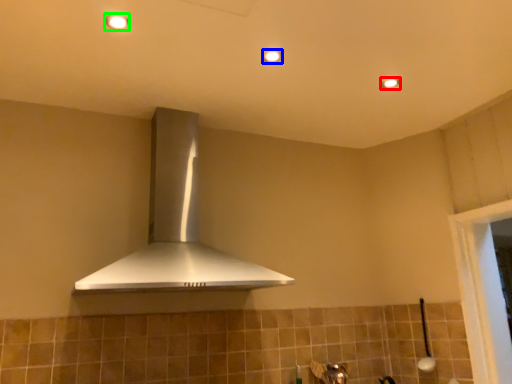
Question: Which is nearer to the light fixture (highlighted by a red box)? light fixture (highlighted by a blue box) or light fixture (highlighted by a green box).

Choices:
 (A) light fixture
 (B) light fixture

Answer: (A)